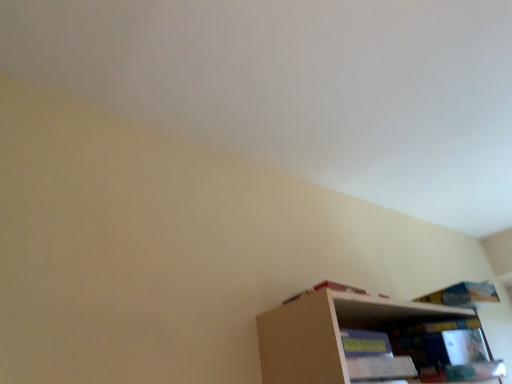
Question: Does wooden bookshelf at lower right appear on the right side of blue paper book at upper right, marked as the first book in a right-to-left arrangement?

Choices:
 (A) yes
 (B) no

Answer: (B)

Question: Is wooden bookshelf at lower right not within blue paper book at upper right, marked as the first book in a right-to-left arrangement?

Choices:
 (A) yes
 (B) no

Answer: (A)

Question: From the image's perspective, is wooden bookshelf at lower right over blue paper book at upper right, marked as the first book in a right-to-left arrangement?

Choices:
 (A) yes
 (B) no

Answer: (B)

Question: Is wooden bookshelf at lower right not near blue paper book at upper right, which appears as the 2th book when viewed from the left?

Choices:
 (A) no
 (B) yes

Answer: (A)

Question: From a real-world perspective, is wooden bookshelf at lower right located higher than blue paper book at upper right, placed as the second book when sorted from front to back?

Choices:
 (A) no
 (B) yes

Answer: (A)

Question: Is white cardboard book at upper right, the first book in the front-to-back sequence, inside the boundaries of blue paper book at upper right, marked as the first book in a right-to-left arrangement, or outside?

Choices:
 (A) outside
 (B) inside

Answer: (A)

Question: Is white cardboard book at upper right, the first book in the front-to-back sequence, to the left or to the right of blue paper book at upper right, which appears as the 2th book when viewed from the left, in the image?

Choices:
 (A) left
 (B) right

Answer: (A)

Question: Is white cardboard book at upper right, the first book in the front-to-back sequence, bigger or smaller than blue paper book at upper right, marked as the first book in a right-to-left arrangement?

Choices:
 (A) big
 (B) small

Answer: (B)

Question: Considering the positions of white cardboard book at upper right, which is the 2th book from back to front, and blue paper book at upper right, which appears as the 2th book when viewed from the left, in the image, is white cardboard book at upper right, which is the 2th book from back to front, wider or thinner than blue paper book at upper right, which appears as the 2th book when viewed from the left,?

Choices:
 (A) wide
 (B) thin

Answer: (A)

Question: Choose the correct answer: Is blue paper book at upper right, placed as the second book when sorted from front to back, inside white cardboard book at upper right, which is the 2th book from back to front, or outside it?

Choices:
 (A) inside
 (B) outside

Answer: (B)

Question: Considering the positions of blue paper book at upper right, which appears as the 2th book when viewed from the left, and white cardboard book at upper right, which is the 2th book from back to front, in the image, is blue paper book at upper right, which appears as the 2th book when viewed from the left, bigger or smaller than white cardboard book at upper right, which is the 2th book from back to front,?

Choices:
 (A) small
 (B) big

Answer: (B)

Question: From a real-world perspective, relative to white cardboard book at upper right, which is the first book in left-to-right order, is blue paper book at upper right, which appears as the 2th book when viewed from the left, vertically above or below?

Choices:
 (A) above
 (B) below

Answer: (A)

Question: Is blue paper book at upper right, marked as the first book in a right-to-left arrangement, taller or shorter than white cardboard book at upper right, acting as the 2th book starting from the right?

Choices:
 (A) tall
 (B) short

Answer: (A)

Question: Is point (357, 372) closer or farther from the camera than point (456, 299)?

Choices:
 (A) farther
 (B) closer

Answer: (B)

Question: Is wooden bookshelf at lower right in front of or behind blue paper book at upper right, marked as the first book in a back-to-front arrangement, in the image?

Choices:
 (A) behind
 (B) front

Answer: (B)